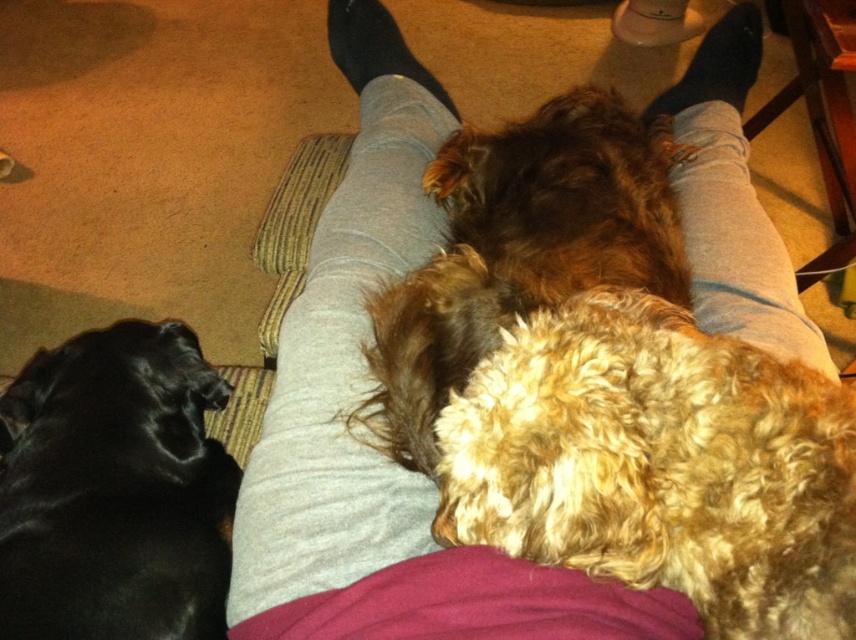
Who is higher up, curly brown fur at center or black fur at lower left?

curly brown fur at center

Who is positioned more to the left, curly brown fur at center or black fur at lower left?

black fur at lower left

Identify the location of curly brown fur at center. The height and width of the screenshot is (640, 856). (520, 257).

Find the location of `curly brown fur at center`. curly brown fur at center is located at coordinates (520, 257).